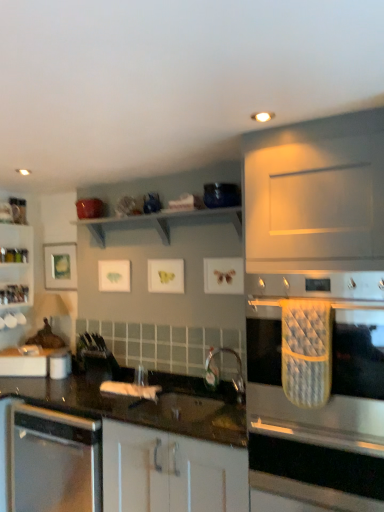
Question: Is stainless steel oven mitt at right to the right of white glossy cabinet at center from the viewer's perspective?

Choices:
 (A) yes
 (B) no

Answer: (A)

Question: Is the position of stainless steel oven mitt at right less distant than that of white glossy cabinet at center?

Choices:
 (A) yes
 (B) no

Answer: (A)

Question: Is stainless steel oven mitt at right not close to white glossy cabinet at center?

Choices:
 (A) yes
 (B) no

Answer: (B)

Question: Are stainless steel oven mitt at right and white glossy cabinet at center making contact?

Choices:
 (A) yes
 (B) no

Answer: (B)

Question: From a real-world perspective, is stainless steel oven mitt at right under white glossy cabinet at center?

Choices:
 (A) no
 (B) yes

Answer: (A)

Question: Is satin black countertop at lower left to the left or to the right of stainless steel oven mitt at right in the image?

Choices:
 (A) left
 (B) right

Answer: (A)

Question: Does point (43, 437) appear closer or farther from the camera than point (355, 404)?

Choices:
 (A) farther
 (B) closer

Answer: (A)

Question: Which is correct: satin black countertop at lower left is inside stainless steel oven mitt at right, or outside of it?

Choices:
 (A) outside
 (B) inside

Answer: (A)

Question: Is satin black countertop at lower left taller or shorter than stainless steel oven mitt at right?

Choices:
 (A) tall
 (B) short

Answer: (A)

Question: Considering the positions of point (28, 227) and point (77, 457), is point (28, 227) closer or farther from the camera than point (77, 457)?

Choices:
 (A) closer
 (B) farther

Answer: (B)

Question: Is clear glass shelves at left taller or shorter than satin black countertop at lower left?

Choices:
 (A) tall
 (B) short

Answer: (B)

Question: Is clear glass shelves at left bigger or smaller than satin black countertop at lower left?

Choices:
 (A) small
 (B) big

Answer: (A)

Question: Would you say clear glass shelves at left is inside or outside satin black countertop at lower left?

Choices:
 (A) outside
 (B) inside

Answer: (A)

Question: Visually, is stainless steel oven mitt at right positioned to the left or to the right of metallic silver faucet at center?

Choices:
 (A) left
 (B) right

Answer: (B)

Question: From the image's perspective, relative to metallic silver faucet at center, is stainless steel oven mitt at right above or below?

Choices:
 (A) above
 (B) below

Answer: (A)